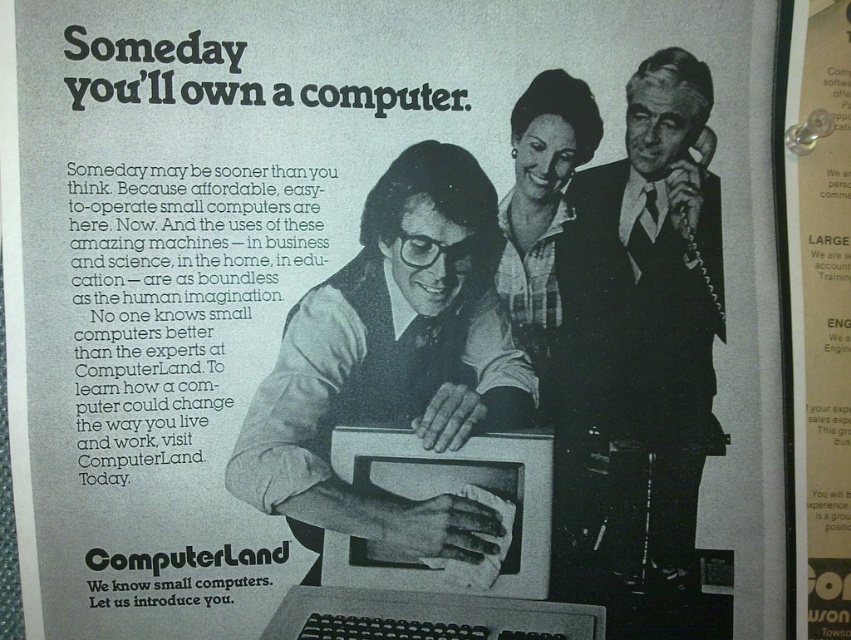
Between point (283, 381) and point (638, 99), which one is positioned in front?

Point (283, 381)

Is matte black computer at center smaller than satin black suit at upper right?

No, matte black computer at center is not smaller than satin black suit at upper right.

This screenshot has width=851, height=640. What do you see at coordinates (392, 362) in the screenshot?
I see `matte black computer at center` at bounding box center [392, 362].

The height and width of the screenshot is (640, 851). I want to click on matte black computer at center, so click(392, 362).